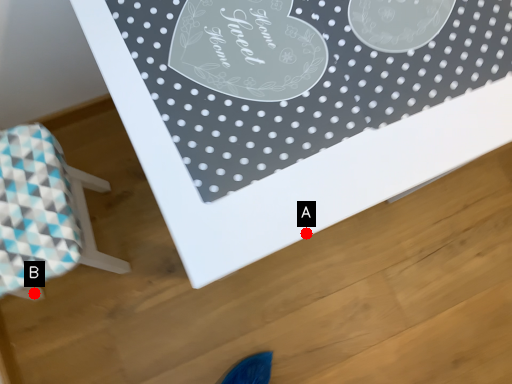
Question: Two points are circled on the image, labeled by A and B beside each circle. Which point is closer to the camera?

Choices:
 (A) A is closer
 (B) B is closer

Answer: (A)